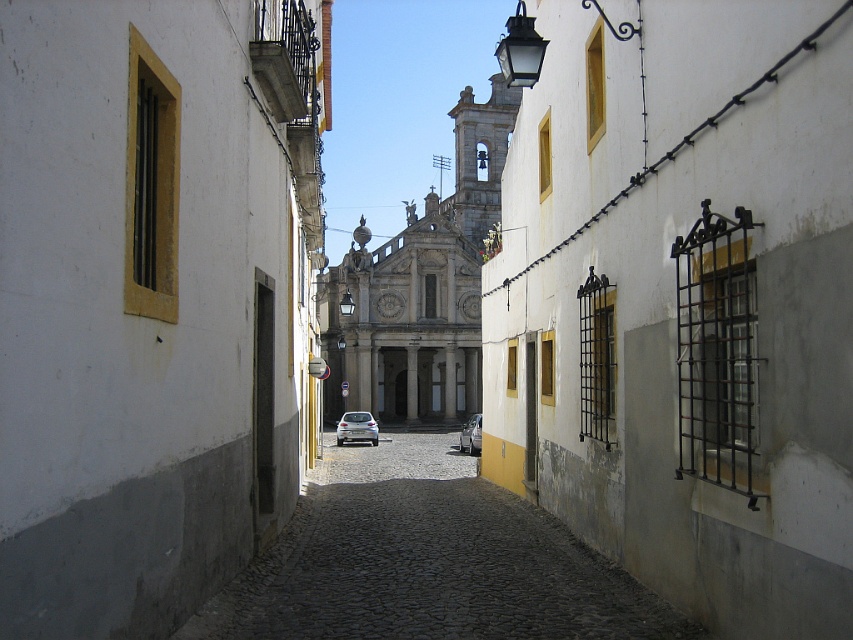
Does white plaster wall at center come behind silver metallic car at center?

No, it is in front of silver metallic car at center.

Is white plaster wall at center bigger than silver metallic car at center?

Yes.

Find the location of `white plaster wall at center`. white plaster wall at center is located at coordinates (683, 304).

You are a GUI agent. You are given a task and a screenshot of the screen. Output one action in this format:
    pyautogui.click(x=<x>, y=<y>)
    Task: Click on the white plaster wall at center
    
    Given the screenshot: What is the action you would take?
    pyautogui.click(x=683, y=304)

From the picture: Does white plaster wall at left come in front of silver metallic car at center?

Yes.

Is the position of white plaster wall at left more distant than that of silver metallic car at center?

No, white plaster wall at left is in front of silver metallic car at center.

I want to click on white plaster wall at left, so click(154, 300).

From the picture: Does white stone church at center have a greater height compared to silver metallic car at center?

Yes.

Is white stone church at center wider than silver metallic car at center?

Correct, the width of white stone church at center exceeds that of silver metallic car at center.

Who is more distant from viewer, (396, 262) or (462, 436)?

Point (396, 262)

Identify the location of white stone church at center. The width and height of the screenshot is (853, 640). (421, 288).